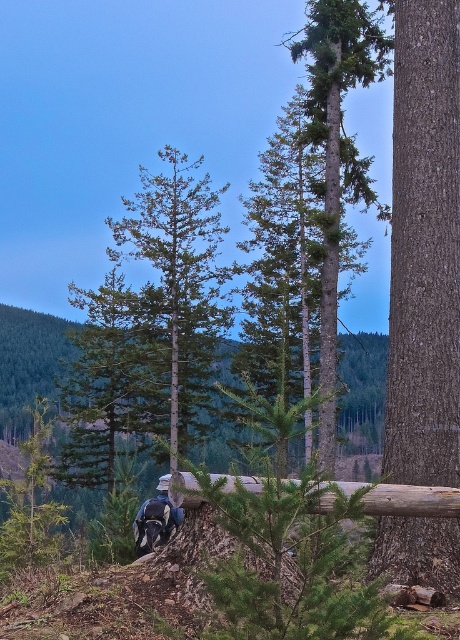
You are a hiker trying to take a photo of the smooth brown tree trunk at right. However, there is a dark blue fabric mountain biker at center in the way. Can you move to the left or right to get a clear shot of the tree trunk without the biker blocking it?

The dark blue fabric mountain biker at center is behind the smooth brown tree trunk at right, so moving to the left or right might allow you to position yourself where the biker is no longer blocking the view of the tree trunk.

You are a hiker in the forest and see the smooth brown tree trunk at right and the dark blue fabric mountain biker at center. Which object is taller?

The dark blue fabric mountain biker at center is taller than the smooth brown tree trunk at right.